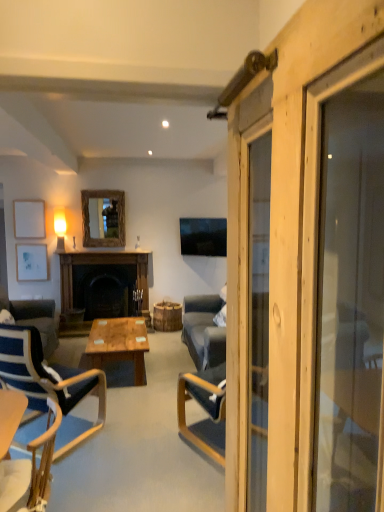
I want to click on vacant area located to the right-hand side of blue fabric chair at left, which is the 1th chair in back-to-front order, so click(135, 448).